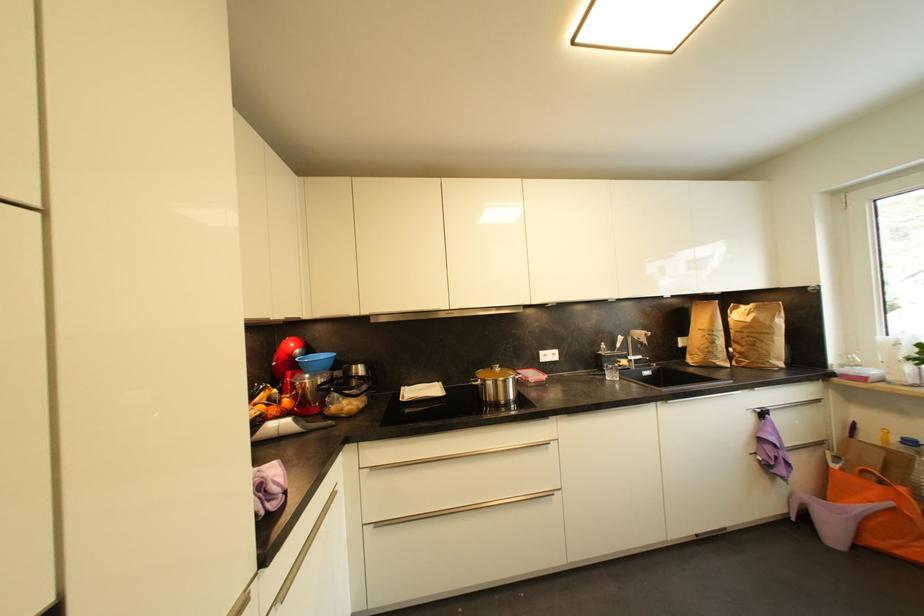
This screenshot has width=924, height=616. What do you see at coordinates (496, 386) in the screenshot?
I see `a pot lid handle` at bounding box center [496, 386].